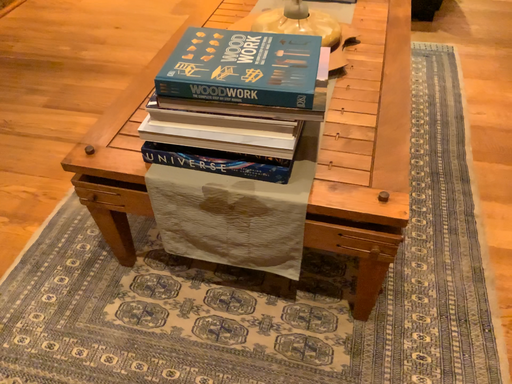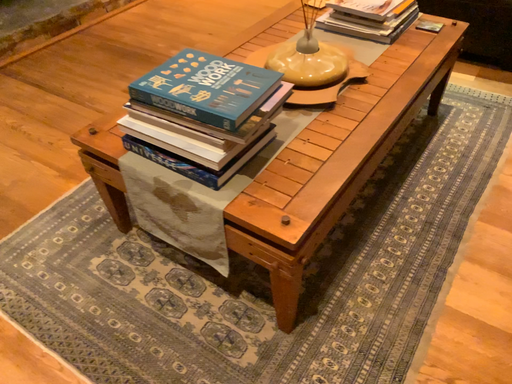
Question: How did the camera likely rotate when shooting the video?

Choices:
 (A) rotated right
 (B) rotated left

Answer: (B)